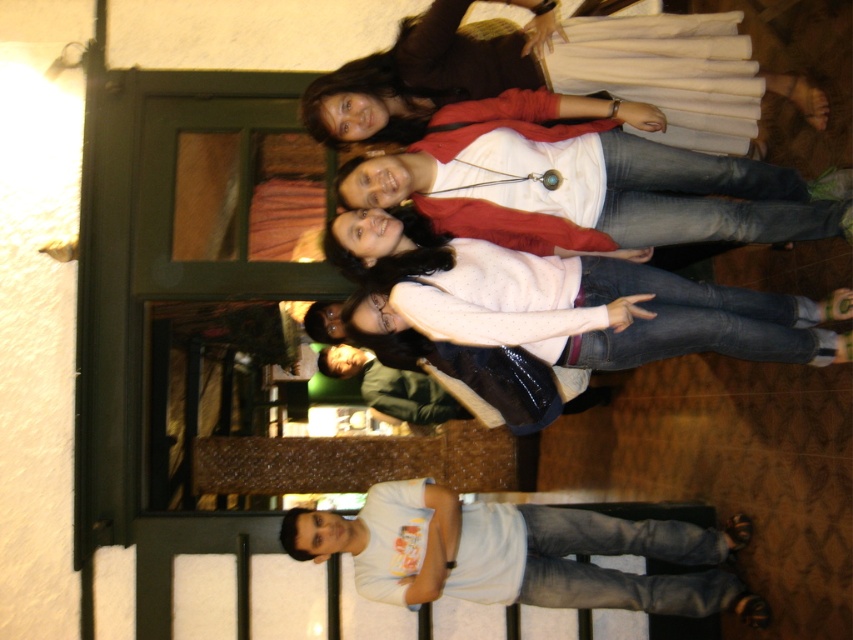
You are standing in the room and want to hand a gift to both the white matte sweater at center and the white matte shirt at center. Which one should you approach first to ensure you can reach them without moving around others?

You should approach the white matte sweater at center first because it is closer to you than the white matte shirt at center, so you can reach them without needing to move around others.